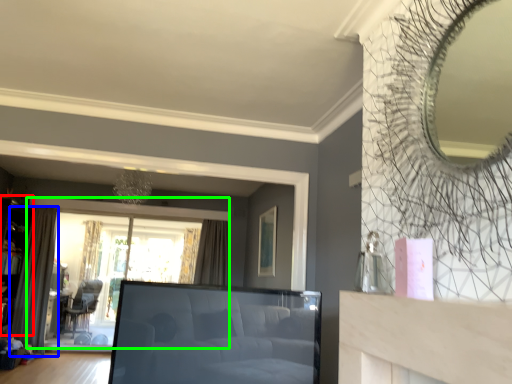
Question: Based on their relative distances, which object is farther from shelf (highlighted by a red box)? Choose from curtain (highlighted by a blue box) and window (highlighted by a green box).

Choices:
 (A) curtain
 (B) window

Answer: (B)